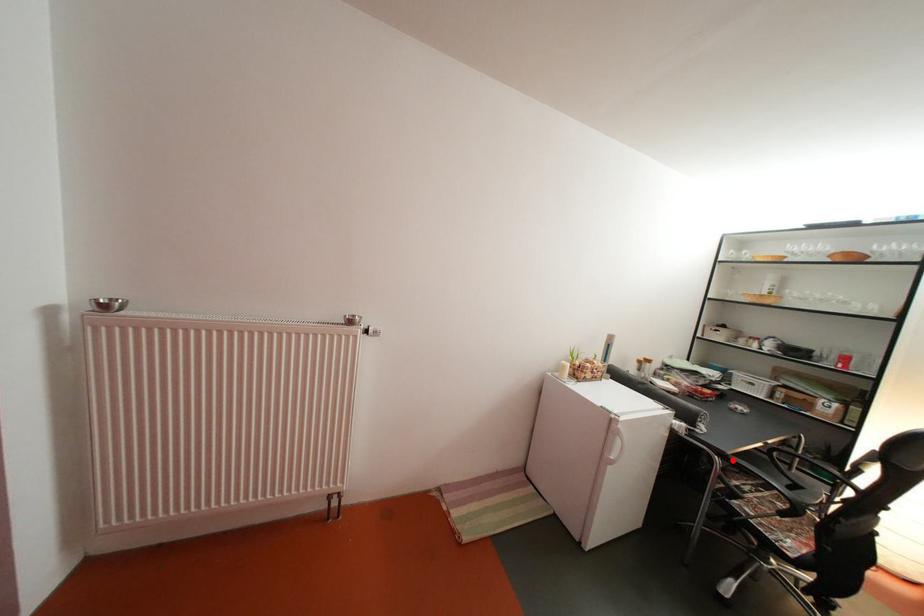
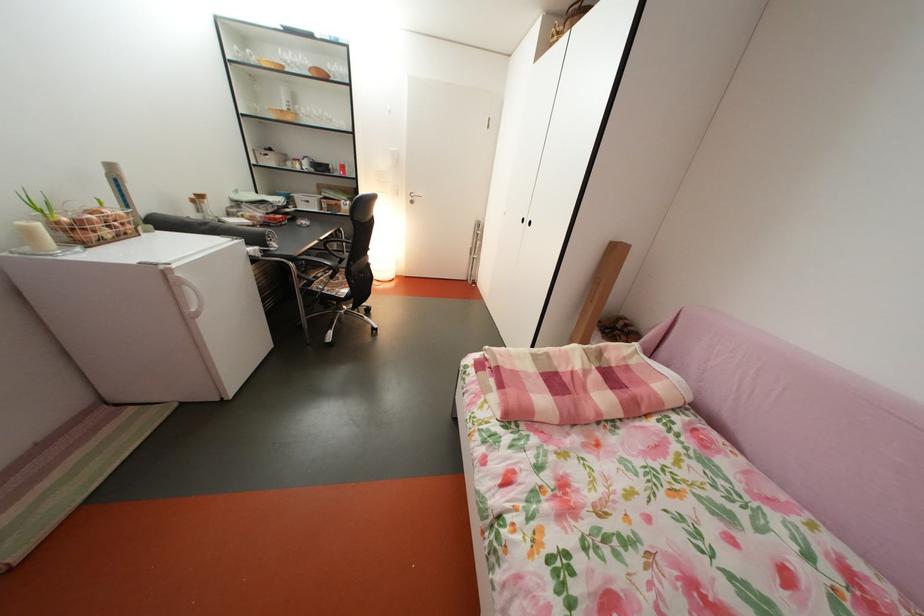
Question: A red point is marked in image1. In image2, is the corresponding 3D point closer to the camera or farther? Reply with the corresponding letter.

Choices:
 (A) The corresponding 3D point is closer.
 (B) The corresponding 3D point is farther.

Answer: (A)